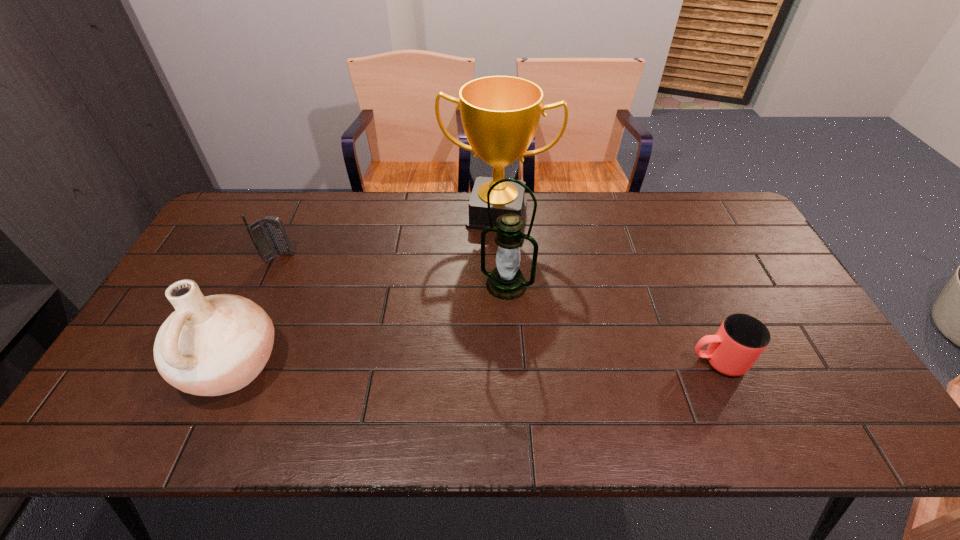
I want to click on free space between the cup and the fourth tallest object, so [498, 309].

Find the location of a particular element. The width and height of the screenshot is (960, 540). object that stands as the closest to the award is located at coordinates (506, 282).

Identify the location of the closest object to the award. The image size is (960, 540). (506, 282).

The image size is (960, 540). I want to click on free space in the image that satisfies the following two spatial constraints: 1. on the front side of the second tallest object; 2. on the handle side of the rightmost object, so [x=511, y=361].

At what (x,y) coordinates should I click in order to perform the action: click on vacant space that satisfies the following two spatial constraints: 1. on the front side of the rightmost object; 2. on the handle side of the cellular telephone. Please return your answer as a coordinate pair (x, y). Image resolution: width=960 pixels, height=540 pixels. Looking at the image, I should click on (231, 361).

Identify the location of free space that satisfies the following two spatial constraints: 1. on the front side of the fourth shortest object; 2. on the handle side of the shortest object. (511, 361).

At what (x,y) coordinates should I click in order to perform the action: click on free space that satisfies the following two spatial constraints: 1. on the front side of the award; 2. on the handle side of the shortest object. Please return your answer as a coordinate pair (x, y). Looking at the image, I should click on (503, 361).